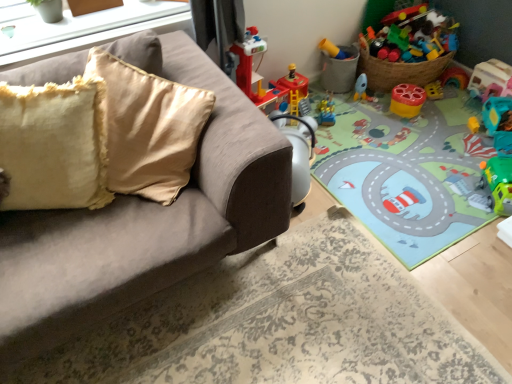
Question: Would you say matte white window sill at upper left is to the left or to the right of translucent plastic toy car at upper right, the first toy when ordered from right to left, in the picture?

Choices:
 (A) right
 (B) left

Answer: (B)

Question: In terms of height, does matte white window sill at upper left look taller or shorter compared to translucent plastic toy car at upper right, which is the sixth toy in left-to-right order?

Choices:
 (A) short
 (B) tall

Answer: (A)

Question: Estimate the real-world distances between objects in this image. Which object is closer to the translucent plastic toy at center, the 1th toy positioned from the left?

Choices:
 (A) fuzzy yellow pillow at left
 (B) rubber duck at lower right, marked as the fifth toy in a left-to-right arrangement
 (C) matte white window sill at upper left
 (D) translucent plastic toy car at upper right, which is the sixth toy in left-to-right order
 (E) suede-like gray couch at upper left

Answer: (B)

Question: Estimate the real-world distances between objects in this image. Which object is closer to the green plastic toy car at lower right, the third toy from the right?

Choices:
 (A) suede-like gray couch at upper left
 (B) matte white window sill at upper left
 (C) matte plastic bucket at upper right, which is the 2th toy from left to right
 (D) fuzzy yellow pillow at left
 (E) translucent plastic toy at center, the 1th toy positioned from the left

Answer: (E)